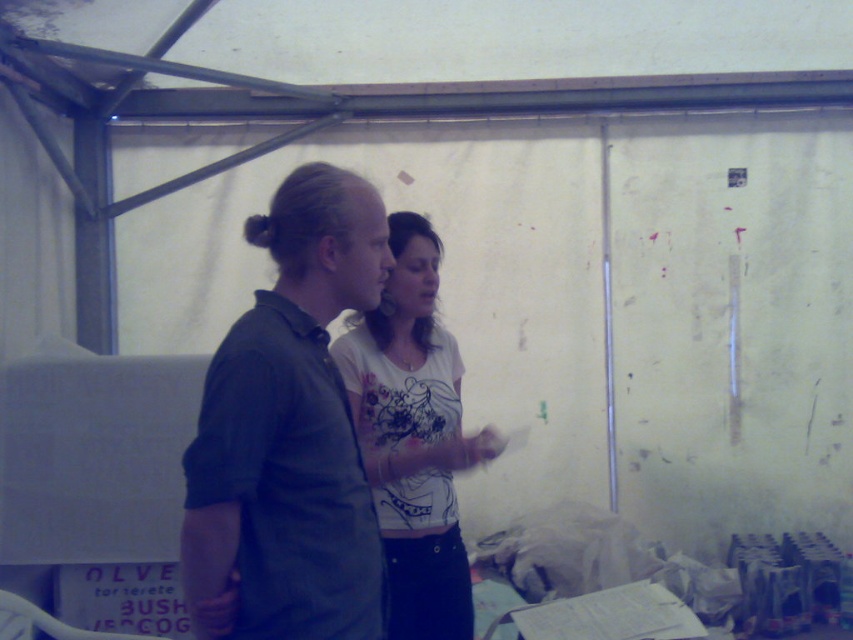
Question: Is dark green shirt at center positioned at the back of white cotton shirt at center?

Choices:
 (A) yes
 (B) no

Answer: (B)

Question: Can you confirm if dark green shirt at center is thinner than white cotton shirt at center?

Choices:
 (A) yes
 (B) no

Answer: (A)

Question: Which point appears closest to the camera in this image?

Choices:
 (A) (386, 563)
 (B) (291, 497)

Answer: (B)

Question: Does dark green shirt at center come in front of white cotton shirt at center?

Choices:
 (A) yes
 (B) no

Answer: (A)